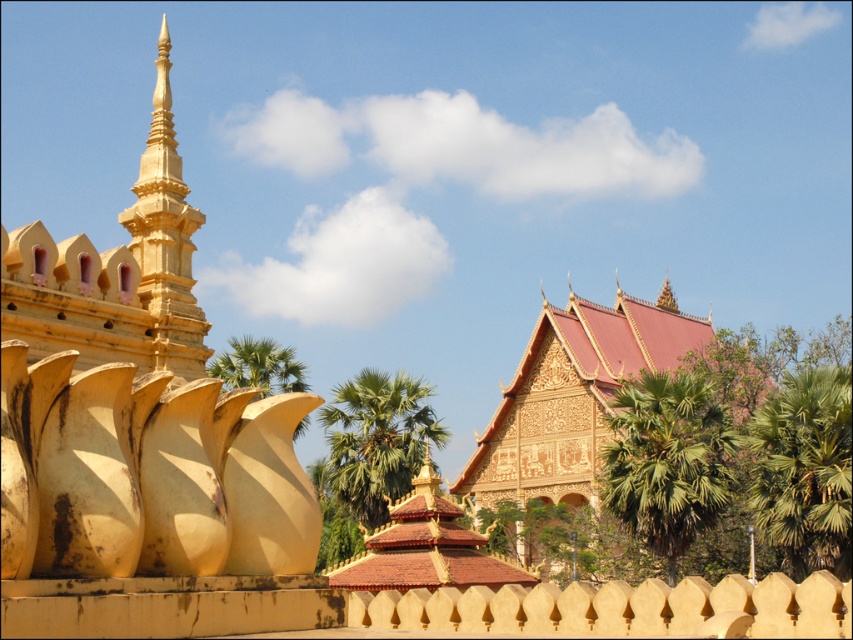
Based on the photo, you are an architect analyzing the proportions of the scene. Which object, the green leafy palm tree at center or the gold textured spire at upper center, occupies more visual space in the image?

The green leafy palm tree at center occupies more visual space than the gold textured spire at upper center because it is larger in size according to the description.

You are standing in the scene and want to take a photo of both the green leafy palm tree at right and the green leafy palm tree at center. Which palm tree is positioned higher in your camera frame?

The green leafy palm tree at right is positioned higher in the camera frame because it is above the green leafy palm tree at center.